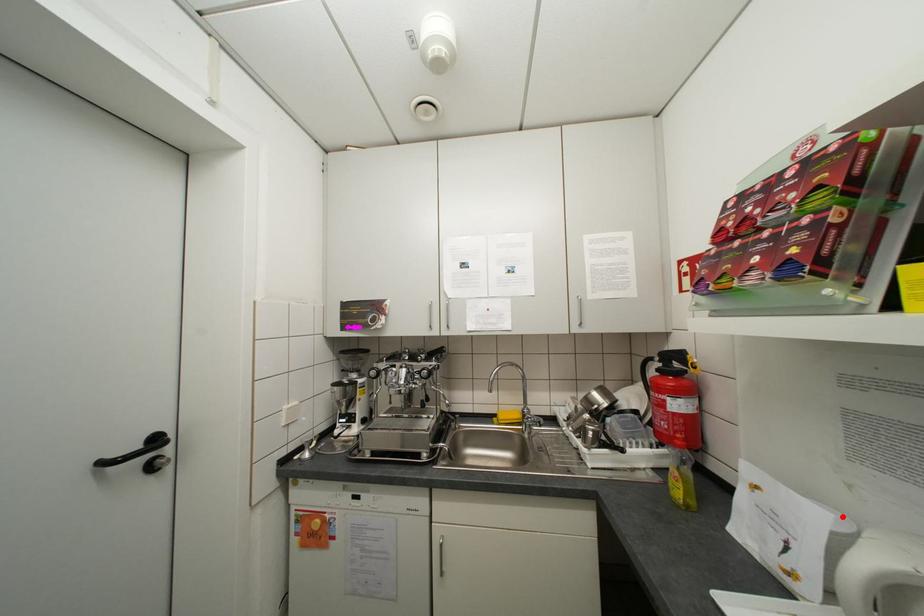
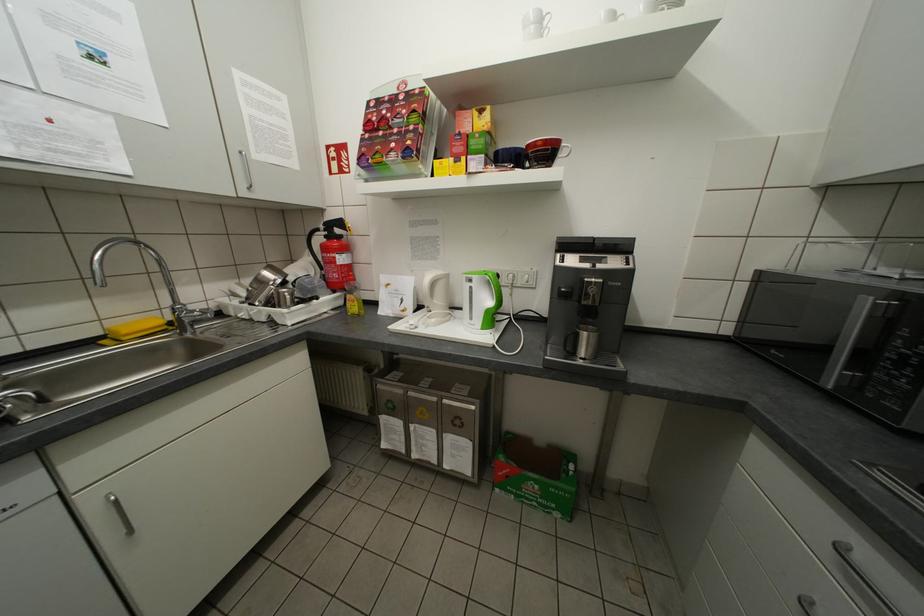
Where in the second image is the point corresponding to the highlighted location from the first image?

(423, 277)